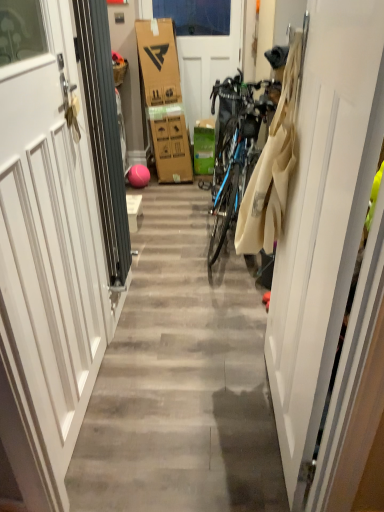
Question: Does white matte door at center, positioned as the second door in left-to-right order, appear on the left side of white matte door at center, which is the first door from front to back?

Choices:
 (A) no
 (B) yes

Answer: (B)

Question: From a real-world perspective, is white matte door at center, the 2th door from the right, under white matte door at center, the first door viewed from the right?

Choices:
 (A) no
 (B) yes

Answer: (A)

Question: From the image's perspective, is white matte door at center, marked as the 3th door in a front-to-back arrangement, beneath white matte door at center, the 3th door viewed from the back?

Choices:
 (A) no
 (B) yes

Answer: (A)

Question: Are white matte door at center, the 2th door from the right, and white matte door at center, the first door viewed from the right, far apart?

Choices:
 (A) no
 (B) yes

Answer: (B)

Question: Is white matte door at center, marked as the 3th door in a front-to-back arrangement, positioned in front of white matte door at center, the 3th door viewed from the back?

Choices:
 (A) yes
 (B) no

Answer: (B)

Question: Based on their sizes in the image, would you say white matte door at center, marked as the 3th door in a front-to-back arrangement, is bigger or smaller than white matte door at center, which is the first door from front to back?

Choices:
 (A) big
 (B) small

Answer: (A)

Question: Is point (241, 5) positioned closer to the camera than point (296, 352)?

Choices:
 (A) closer
 (B) farther

Answer: (B)

Question: From a real-world perspective, is white matte door at center, positioned as the second door in left-to-right order, above or below white matte door at center, the first door viewed from the right?

Choices:
 (A) below
 (B) above

Answer: (B)

Question: Is white matte door at center, the 2th door from the right, wider or thinner than white matte door at center, which is the first door from front to back?

Choices:
 (A) thin
 (B) wide

Answer: (B)

Question: From a real-world perspective, is white matte door at center, marked as the 3th door in a front-to-back arrangement, above or below green cardboard box at center?

Choices:
 (A) below
 (B) above

Answer: (B)

Question: In terms of width, does white matte door at center, which is counted as the first door, starting from the back, look wider or thinner when compared to green cardboard box at center?

Choices:
 (A) thin
 (B) wide

Answer: (A)

Question: In terms of height, does white matte door at center, which is counted as the first door, starting from the back, look taller or shorter compared to green cardboard box at center?

Choices:
 (A) tall
 (B) short

Answer: (A)

Question: Would you say white matte door at center, which is counted as the first door, starting from the back, is to the left or to the right of green cardboard box at center in the picture?

Choices:
 (A) right
 (B) left

Answer: (B)

Question: From the image's perspective, relative to green cardboard box at center, is white matte door at center, which is the first door from front to back, above or below?

Choices:
 (A) above
 (B) below

Answer: (B)

Question: Considering the positions of white matte door at center, which is the third door from left to right, and green cardboard box at center in the image, is white matte door at center, which is the third door from left to right, bigger or smaller than green cardboard box at center?

Choices:
 (A) small
 (B) big

Answer: (B)